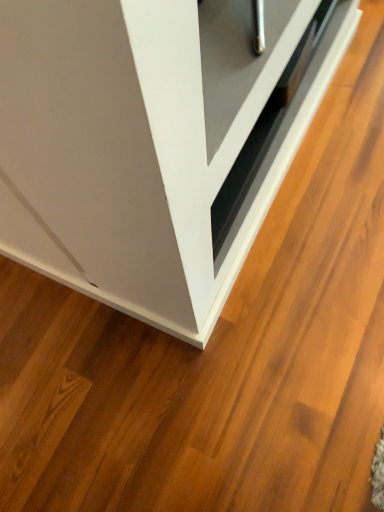
What do you see at coordinates (273, 127) in the screenshot? Image resolution: width=384 pixels, height=512 pixels. I see `matte black drawer at center` at bounding box center [273, 127].

Measure the distance between point (326, 48) and camera.

The depth of point (326, 48) is 1.17 meters.

The height and width of the screenshot is (512, 384). Find the location of `matte black drawer at center`. matte black drawer at center is located at coordinates (273, 127).

The height and width of the screenshot is (512, 384). Describe the element at coordinates (150, 144) in the screenshot. I see `white glossy cabinet at lower right` at that location.

At what (x,y) coordinates should I click in order to perform the action: click on white glossy cabinet at lower right. Please return your answer as a coordinate pair (x, y). Looking at the image, I should click on (150, 144).

At what (x,y) coordinates should I click in order to perform the action: click on matte black drawer at center. Please return your answer as a coordinate pair (x, y). Looking at the image, I should click on (273, 127).

Is white glossy cabinet at lower right to the left of matte black drawer at center from the viewer's perspective?

Indeed, white glossy cabinet at lower right is positioned on the left side of matte black drawer at center.

Is the position of white glossy cabinet at lower right more distant than that of matte black drawer at center?

No, white glossy cabinet at lower right is in front of matte black drawer at center.

Between point (160, 267) and point (236, 228), which one is positioned in front?

Point (160, 267)

From the image's perspective, is white glossy cabinet at lower right above or below matte black drawer at center?

From the image's perspective, white glossy cabinet at lower right appears below matte black drawer at center.

From a real-world perspective, is white glossy cabinet at lower right on top of matte black drawer at center?

No, from a real-world perspective, white glossy cabinet at lower right is not on top of matte black drawer at center.

Looking at their sizes, would you say white glossy cabinet at lower right is wider or thinner than matte black drawer at center?

Clearly, white glossy cabinet at lower right has more width compared to matte black drawer at center.

Does white glossy cabinet at lower right have a greater height compared to matte black drawer at center?

Yes.

In the scene shown: Looking at the image, does white glossy cabinet at lower right seem bigger or smaller compared to matte black drawer at center?

Clearly, white glossy cabinet at lower right is larger in size than matte black drawer at center.

Is white glossy cabinet at lower right inside or outside of matte black drawer at center?

white glossy cabinet at lower right cannot be found inside matte black drawer at center.

Is there a large distance between white glossy cabinet at lower right and matte black drawer at center?

That's not correct — white glossy cabinet at lower right is a little close to matte black drawer at center.

Does white glossy cabinet at lower right turn towards matte black drawer at center?

No, white glossy cabinet at lower right is not aimed at matte black drawer at center.

How many degrees apart are the facing directions of white glossy cabinet at lower right and matte black drawer at center?

They differ by 91.6 degrees in their facing directions.

You are a GUI agent. You are given a task and a screenshot of the screen. Output one action in this format:
    pyautogui.click(x=<x>, y=<y>)
    Task: Click on the cabinetry that appears in front of the matte black drawer at center
    
    Given the screenshot: What is the action you would take?
    pyautogui.click(x=150, y=144)

Is matte black drawer at center at the left side of white glossy cabinet at lower right?

No.

Which object is closer to the camera, matte black drawer at center or white glossy cabinet at lower right?

white glossy cabinet at lower right is in front.

Is point (332, 36) closer to camera compared to point (52, 103)?

No, (332, 36) is further to viewer.

From the image's perspective, who appears lower, matte black drawer at center or white glossy cabinet at lower right?

white glossy cabinet at lower right.

From a real-world perspective, is matte black drawer at center positioned over white glossy cabinet at lower right based on gravity?

Yes, from a real-world perspective, matte black drawer at center is on top of white glossy cabinet at lower right.

Can you confirm if matte black drawer at center is wider than white glossy cabinet at lower right?

No.

Which of these two, matte black drawer at center or white glossy cabinet at lower right, stands shorter?

matte black drawer at center is shorter.

Considering the sizes of objects matte black drawer at center and white glossy cabinet at lower right in the image provided, who is smaller, matte black drawer at center or white glossy cabinet at lower right?

With smaller size is matte black drawer at center.

Could white glossy cabinet at lower right be considered to be inside matte black drawer at center?

No, white glossy cabinet at lower right is not surrounded by matte black drawer at center.

Looking at this image, would you consider matte black drawer at center to be distant from white glossy cabinet at lower right?

No, matte black drawer at center is in close proximity to white glossy cabinet at lower right.

Could you tell me if matte black drawer at center is facing white glossy cabinet at lower right?

No, matte black drawer at center is not aimed at white glossy cabinet at lower right.

What's the angular difference between matte black drawer at center and white glossy cabinet at lower right's facing directions?

The angle between the facing direction of matte black drawer at center and the facing direction of white glossy cabinet at lower right is 91.6 degrees.

How much distance is there between matte black drawer at center and white glossy cabinet at lower right?

6.37 inches.

Identify the location of cabinetry below the matte black drawer at center (from a real-world perspective). Image resolution: width=384 pixels, height=512 pixels. (150, 144).

The image size is (384, 512). Identify the location of drawer above the white glossy cabinet at lower right (from a real-world perspective). (273, 127).

Locate an element on the screen. cabinetry that is below the matte black drawer at center (from the image's perspective) is located at coordinates (150, 144).